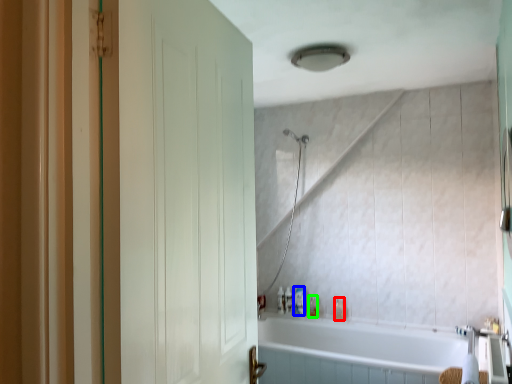
Question: Estimate the real-world distances between objects in this image. Which object is closer to toiletry (highlighted by a red box), toiletry (highlighted by a blue box) or toiletry (highlighted by a green box)?

Choices:
 (A) toiletry
 (B) toiletry

Answer: (B)